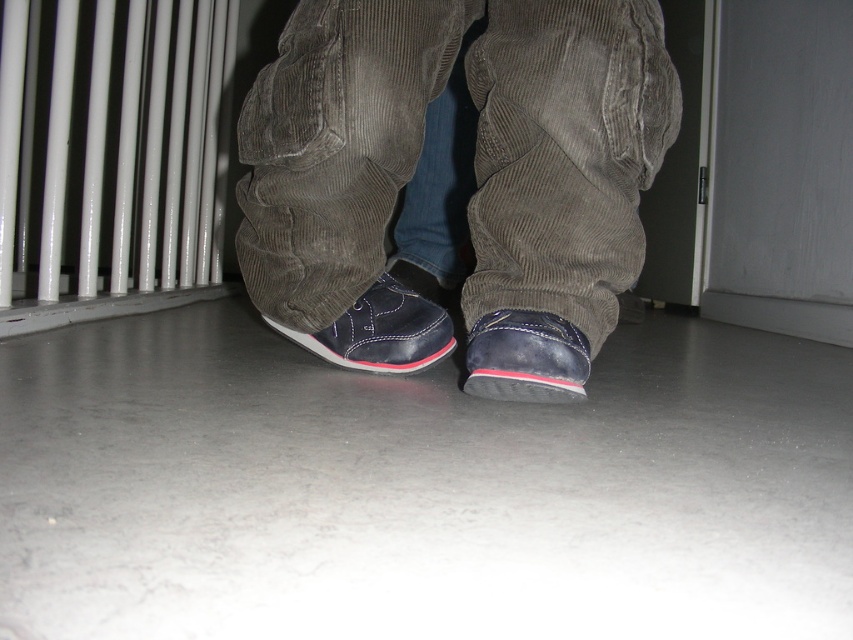
You are a home inspector assessing the space between the matte corduroy pants at center and the white glossy radiator at left. The minimum required clearance for safety is 15 inches. Can you confirm if the space between them meets this requirement?

The matte corduroy pants at center has a lesser width compared to white glossy radiator at left. However, the description does not provide the exact distance between them, so it is impossible to confirm if the space meets the 15 inches requirement.

You are a home inspector assessing the space between the matte corduroy pants at center and the white glossy radiator at left. Can you confirm if there is enough space for a 12 inch wide cleaning tool to fit between them?

The matte corduroy pants at center is not as tall as the white glossy radiator at left, but the description does not provide specific measurements of the space between them. Therefore, it is unclear if the 12 inch wide cleaning tool can fit between them.

You are trying to decide whether to place a decorative item on the floor between the white glossy radiator at left and the matte leather shoe at lower center. Based on their widths, which object occupies more horizontal space and would require more clearance?

The white glossy radiator at left is wider than the matte leather shoe at lower center, so it occupies more horizontal space and requires more clearance.